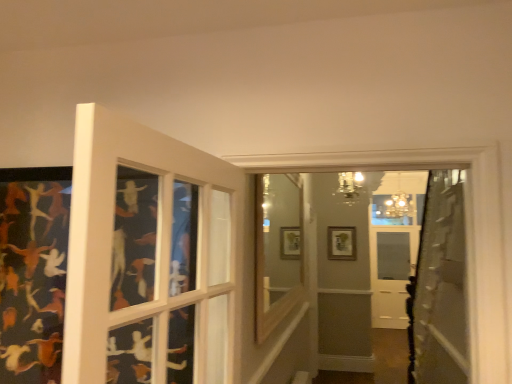
Question: From a real-world perspective, is metallic chandelier at upper center, which ranks as the 1th light fixture in left-to-right order, positioned over wooden picture frame at center based on gravity?

Choices:
 (A) no
 (B) yes

Answer: (B)

Question: From the image's perspective, is metallic chandelier at upper center, which is the second light fixture in right-to-left order, on top of wooden picture frame at center?

Choices:
 (A) yes
 (B) no

Answer: (A)

Question: Is metallic chandelier at upper center, the 1th light fixture when ordered from front to back, positioned far away from wooden picture frame at center?

Choices:
 (A) no
 (B) yes

Answer: (A)

Question: Is metallic chandelier at upper center, the second light fixture when ordered from back to front, thinner than wooden picture frame at center?

Choices:
 (A) yes
 (B) no

Answer: (B)

Question: From the image's perspective, would you say metallic chandelier at upper center, the 1th light fixture when ordered from front to back, is shown under wooden picture frame at center?

Choices:
 (A) yes
 (B) no

Answer: (B)

Question: Does point (350, 173) appear closer or farther from the camera than point (398, 178)?

Choices:
 (A) closer
 (B) farther

Answer: (A)

Question: Is metallic chandelier at upper center, which ranks as the 1th light fixture in left-to-right order, wider or thinner than matte gold chandelier at upper center, which is the 2th light fixture from front to back?

Choices:
 (A) wide
 (B) thin

Answer: (B)

Question: From a real-world perspective, is metallic chandelier at upper center, which ranks as the 1th light fixture in left-to-right order, physically located above or below matte gold chandelier at upper center, the first light fixture from the right?

Choices:
 (A) above
 (B) below

Answer: (B)

Question: Based on their positions, is metallic chandelier at upper center, which is the second light fixture in right-to-left order, located to the left or right of matte gold chandelier at upper center, which appears as the first light fixture when viewed from the back?

Choices:
 (A) right
 (B) left

Answer: (B)

Question: From a real-world perspective, is wooden window frame at center above or below metallic chandelier at upper center, which is the second light fixture in right-to-left order?

Choices:
 (A) above
 (B) below

Answer: (B)

Question: Visually, is wooden window frame at center positioned to the left or to the right of metallic chandelier at upper center, which is the second light fixture in right-to-left order?

Choices:
 (A) left
 (B) right

Answer: (A)

Question: Is wooden window frame at center in front of or behind metallic chandelier at upper center, the 1th light fixture when ordered from front to back, in the image?

Choices:
 (A) front
 (B) behind

Answer: (A)

Question: From the image's perspective, is wooden window frame at center above or below metallic chandelier at upper center, which ranks as the 1th light fixture in left-to-right order?

Choices:
 (A) above
 (B) below

Answer: (B)

Question: From the image's perspective, is wooden picture frame at center located above or below matte gold chandelier at upper center, which ranks as the 2th light fixture in left-to-right order?

Choices:
 (A) below
 (B) above

Answer: (A)

Question: From a real-world perspective, is wooden picture frame at center above or below matte gold chandelier at upper center, which ranks as the 2th light fixture in left-to-right order?

Choices:
 (A) below
 (B) above

Answer: (A)